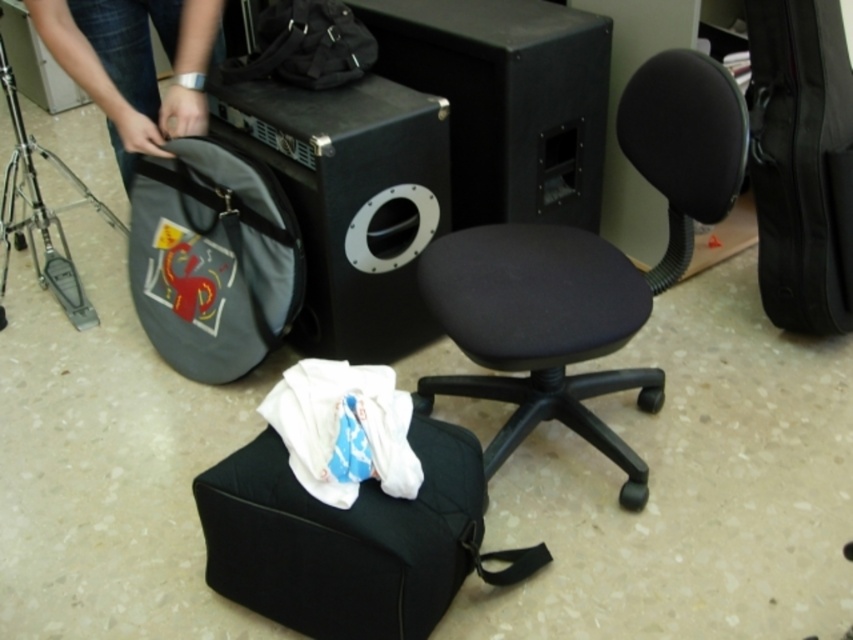
Question: Observing the image, what is the correct spatial positioning of black fabric stool at lower center in reference to matte black backpack at upper center?

Choices:
 (A) right
 (B) left

Answer: (A)

Question: Which point is closer to the camera taking this photo?

Choices:
 (A) (283, 202)
 (B) (370, 45)
 (C) (711, 84)
 (D) (364, 532)

Answer: (D)

Question: Can you confirm if black fabric stool at lower center is thinner than silver metallic tripod at left?

Choices:
 (A) yes
 (B) no

Answer: (B)

Question: Estimate the real-world distances between objects in this image. Which object is closer to the matte black bag at lower left?

Choices:
 (A) silver metallic tripod at left
 (B) black matte speaker at center

Answer: (A)

Question: Does black fabric stool at lower center lie in front of matte black bag at lower left?

Choices:
 (A) no
 (B) yes

Answer: (B)

Question: Among these objects, which one is nearest to the camera?

Choices:
 (A) matte black bag at lower left
 (B) black fabric swivel chair at center
 (C) silver metallic tripod at left
 (D) black matte speaker at center

Answer: (B)